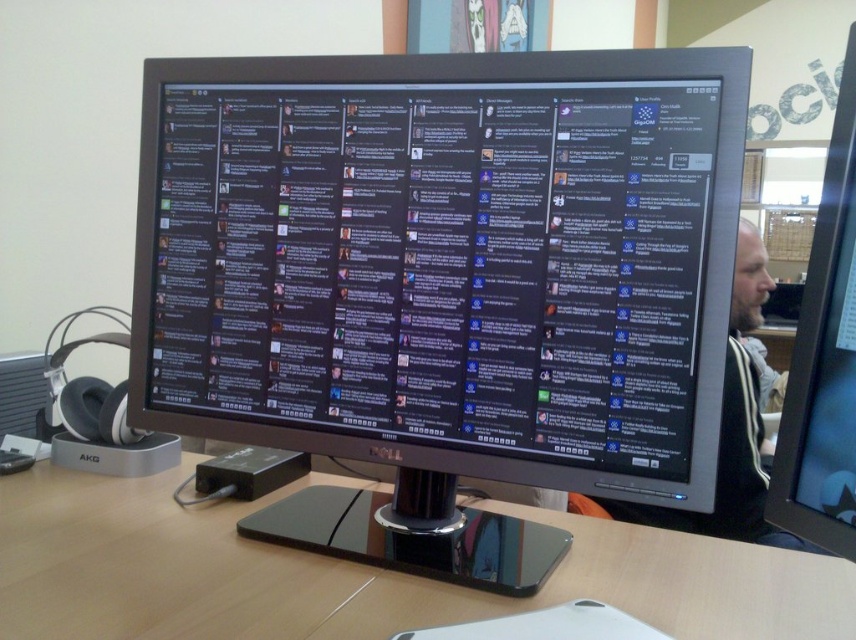
Can you confirm if wooden table at center is bigger than black glossy monitor at right?

Indeed, wooden table at center has a larger size compared to black glossy monitor at right.

Is point (815, 602) positioned in front of point (837, 273)?

No, it is not.

Where is `wooden table at center`? This screenshot has width=856, height=640. wooden table at center is located at coordinates (358, 573).

Between black glossy monitor at center and bearded man at right, which one appears on the right side from the viewer's perspective?

bearded man at right

Find the location of a particular element. The width and height of the screenshot is (856, 640). black glossy monitor at center is located at coordinates (444, 284).

Can you confirm if wooden table at center is positioned below bearded man at right?

Correct, wooden table at center is located below bearded man at right.

Can you confirm if wooden table at center is bigger than bearded man at right?

No.

Is point (116, 525) less distant than point (765, 280)?

Yes.

At what (x,y) coordinates should I click in order to perform the action: click on wooden table at center. Please return your answer as a coordinate pair (x, y). Looking at the image, I should click on 358,573.